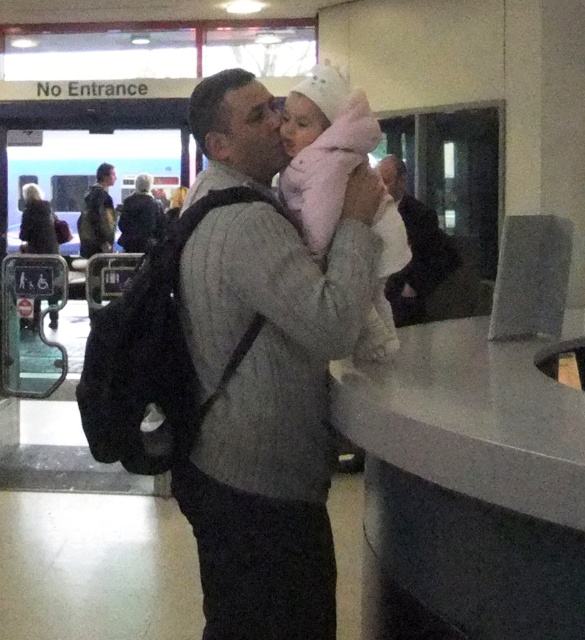
Who is more distant from viewer, (402,164) or (135,182)?

The point (135,182) is more distant.

Does point (425, 288) come closer to viewer compared to point (136, 211)?

Yes, point (425, 288) is in front of point (136, 211).

This screenshot has width=585, height=640. I want to click on dark gray suit at center, so click(x=417, y=250).

Is pink fluffy coat at center taller than dark gray backpack at center?

In fact, pink fluffy coat at center may be shorter than dark gray backpack at center.

Who is higher up, pink fluffy coat at center or dark gray backpack at center?

dark gray backpack at center is higher up.

You are a GUI agent. You are given a task and a screenshot of the screen. Output one action in this format:
    pyautogui.click(x=<x>, y=<y>)
    Task: Click on the pink fluffy coat at center
    This screenshot has width=585, height=640.
    Given the screenshot: What is the action you would take?
    pyautogui.click(x=324, y=150)

Does point (284, 273) come closer to viewer compared to point (101, 241)?

That is True.

Does gray wool sweater at center have a lesser width compared to camouflage fabric jacket at left?

No, gray wool sweater at center is not thinner than camouflage fabric jacket at left.

Between point (236, 467) and point (111, 250), which one is positioned behind?

The point (111, 250) is more distant.

Find the location of a particular element. gray wool sweater at center is located at coordinates (270, 410).